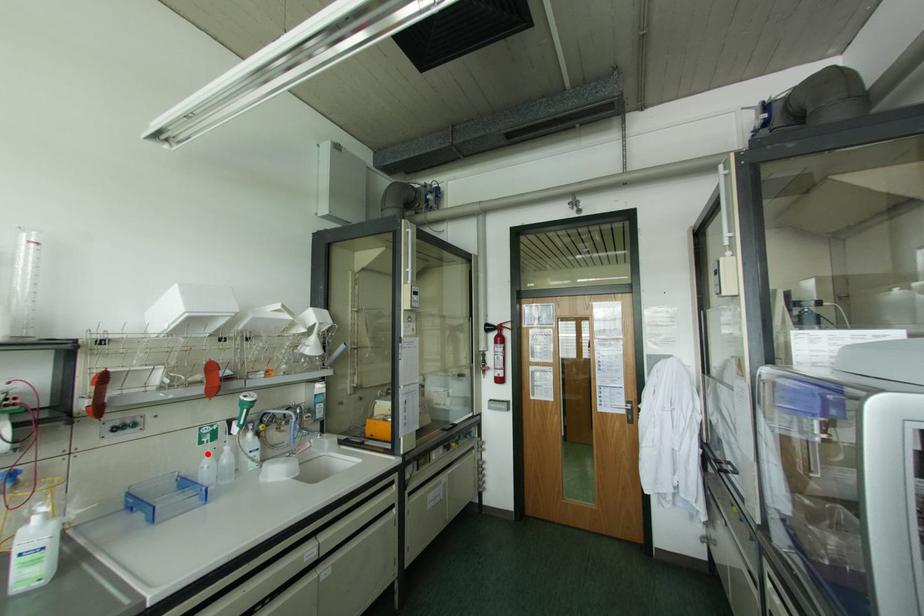
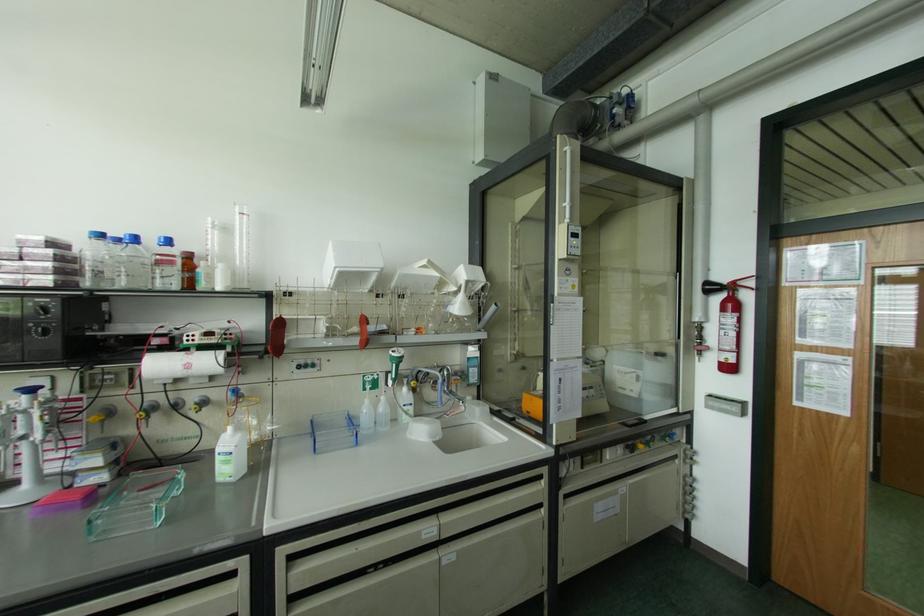
Where in the second image is the point corresponding to the highlighted location from the first image?

(367, 400)